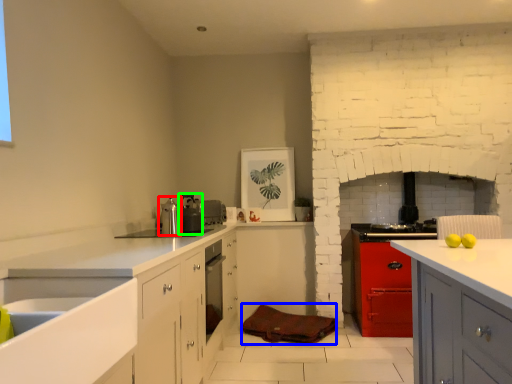
Question: Which object is positioned farthest from kitchen appliance (highlighted by a red box)? Select from material (highlighted by a blue box) and appliance (highlighted by a green box).

Choices:
 (A) material
 (B) appliance

Answer: (A)